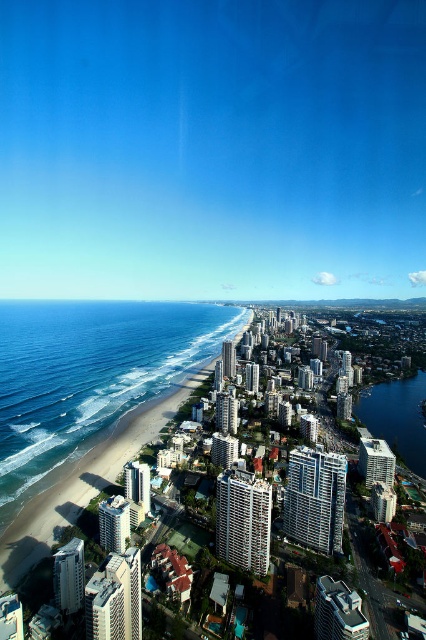
Question: Which point is closer to the camera?

Choices:
 (A) coord(399,401)
 (B) coord(29,420)

Answer: (B)

Question: Can you confirm if blue water at beach left is positioned above blue glassy water at right?

Choices:
 (A) no
 (B) yes

Answer: (B)

Question: Is blue water at beach left bigger than blue glassy water at right?

Choices:
 (A) no
 (B) yes

Answer: (B)

Question: Among these objects, which one is nearest to the camera?

Choices:
 (A) blue glassy water at right
 (B) blue water at beach left

Answer: (B)

Question: Is blue water at beach left below blue glassy water at right?

Choices:
 (A) no
 (B) yes

Answer: (A)